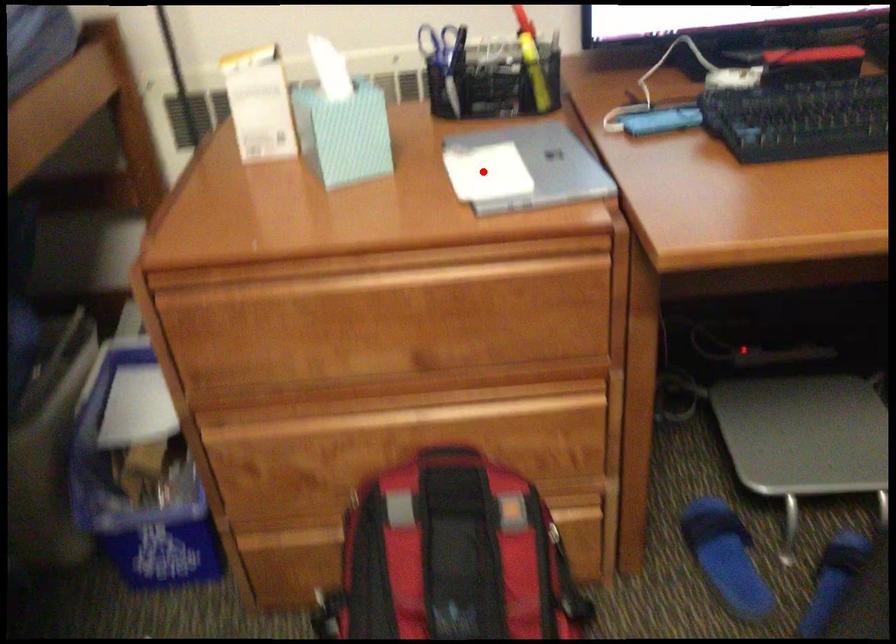
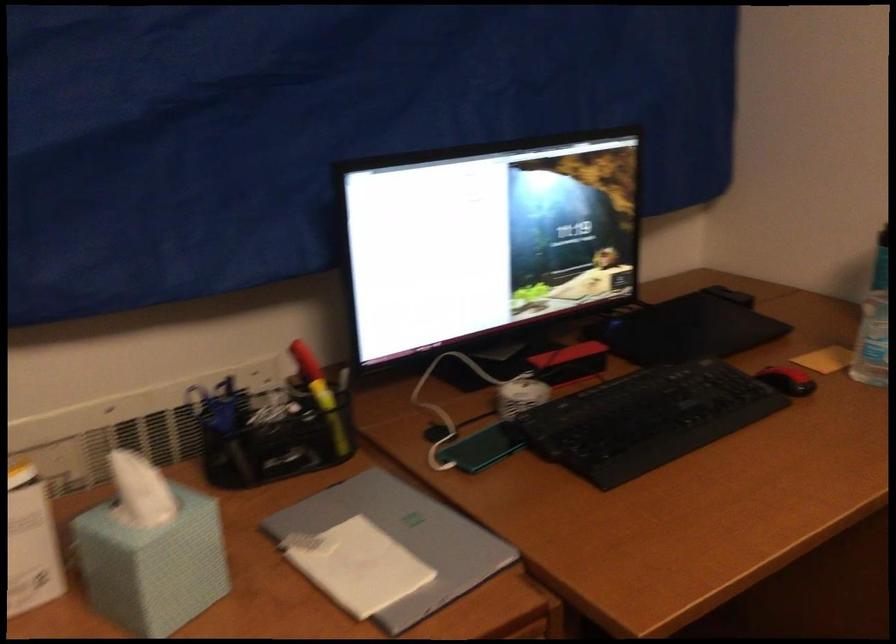
Question: I am providing you with two images of the same scene from different viewpoints. A red point is shown in image1. For the corresponding object point in image2, is it positioned nearer or farther from the camera?

Choices:
 (A) Nearer
 (B) Farther

Answer: (A)